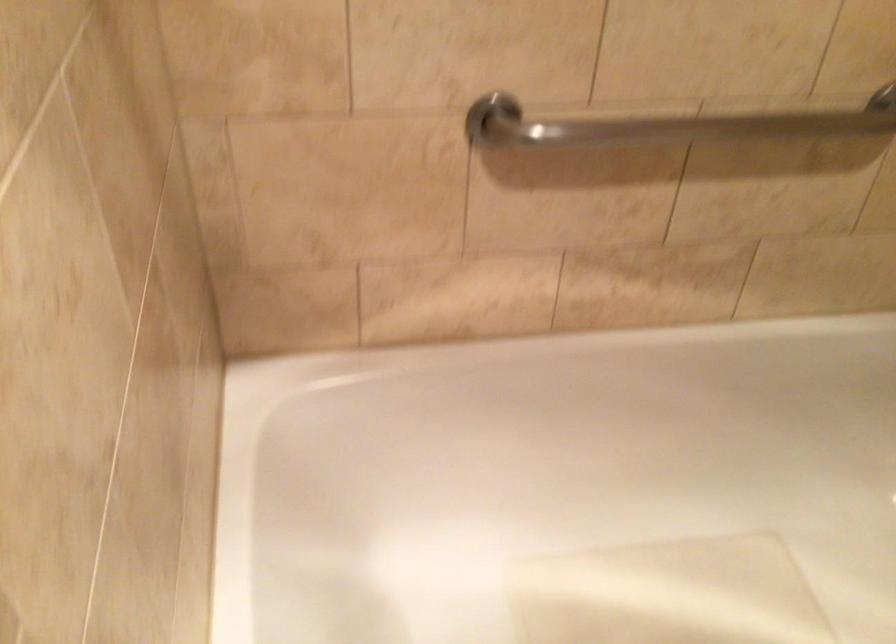
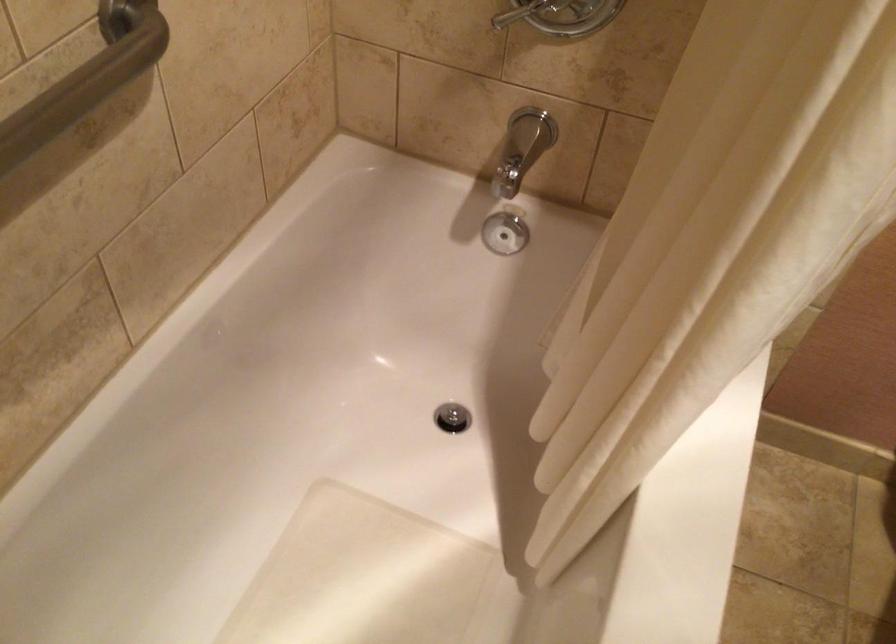
How did the camera likely rotate?

The camera rotated toward right-down.